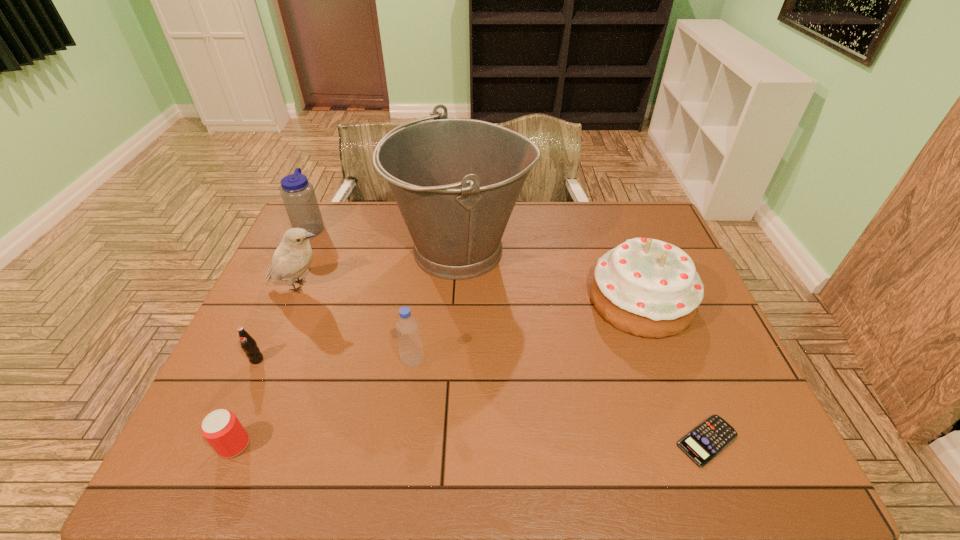
Find the location of a particular element. This screenshot has height=540, width=960. free location that satisfies the following two spatial constraints: 1. on the back side of the cake; 2. on the right side of the seventh tallest object is located at coordinates (296, 300).

Find the location of a particular element. vacant space that satisfies the following two spatial constraints: 1. with a carrying loop on the side of the water bottle; 2. on the right side of the tallest object is located at coordinates (300, 251).

In order to click on free space in the image that satisfies the following two spatial constraints: 1. at the beak of the bottle; 2. on the left side of the bird in this screenshot , I will do `click(268, 361)`.

Where is `free spot that satisfies the following two spatial constraints: 1. on the back side of the second shortest object; 2. at the beak of the bird`? free spot that satisfies the following two spatial constraints: 1. on the back side of the second shortest object; 2. at the beak of the bird is located at coordinates (301, 286).

The height and width of the screenshot is (540, 960). What are the coordinates of `blank area in the image that satisfies the following two spatial constraints: 1. at the beak of the calculator; 2. on the right side of the bird` in the screenshot? It's located at (234, 441).

Find the location of `free location that satisfies the following two spatial constraints: 1. on the front label of the pop; 2. on the right side of the shortest object`. free location that satisfies the following two spatial constraints: 1. on the front label of the pop; 2. on the right side of the shortest object is located at coordinates (221, 441).